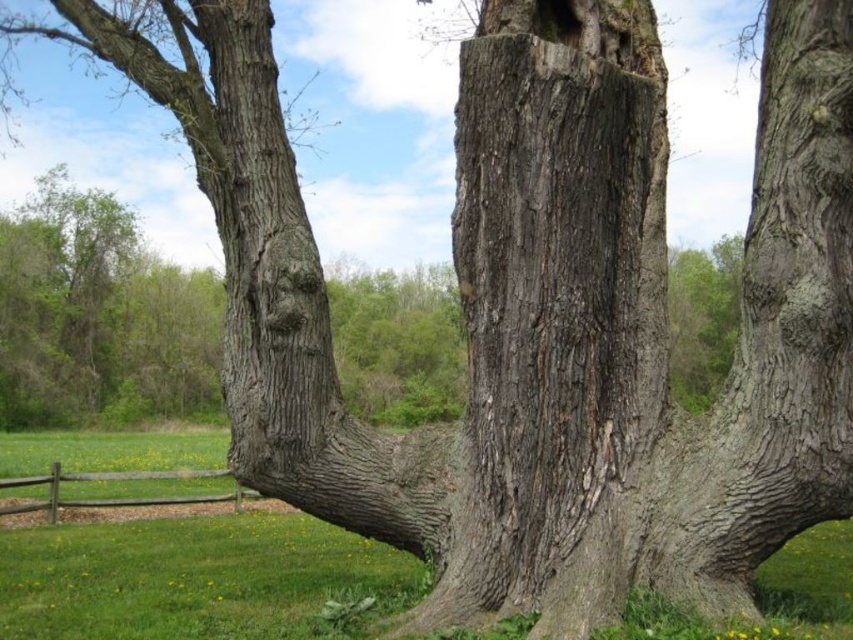
This screenshot has width=853, height=640. What do you see at coordinates (555, 312) in the screenshot?
I see `gray rough bark tree trunk at center` at bounding box center [555, 312].

Which of these two, gray rough bark tree trunk at center or brown wooden fence at lower left, stands shorter?

With less height is brown wooden fence at lower left.

Is point (525, 324) positioned in front of point (241, 497)?

Yes, point (525, 324) is closer to viewer.

You are a GUI agent. You are given a task and a screenshot of the screen. Output one action in this format:
    pyautogui.click(x=<x>, y=<y>)
    Task: Click on the gray rough bark tree trunk at center
    The image size is (853, 640).
    Given the screenshot: What is the action you would take?
    pyautogui.click(x=555, y=312)